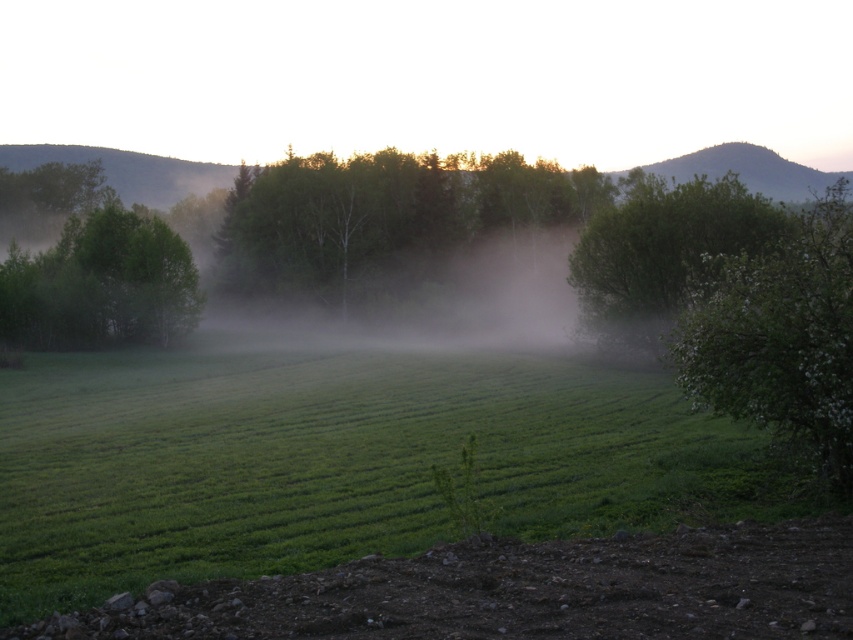
You are a farmer standing in the field and you see the foggy mist at center and the green matte tree at left. Which object is positioned to the right of the other?

The foggy mist at center is to the right of the green matte tree at left.

You are a farmer standing at the edge of the green grassy field at center. You want to reach the green matte tree at left to check its health. Which direction should you walk to get there?

The green grassy field at center is below the green matte tree at left, so you should walk upwards towards the green matte tree at left to reach it.